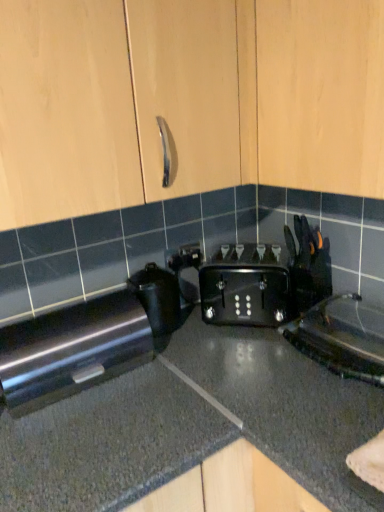
Where is `vacant area that lies between black plastic kettle at lower right, the first appliance positioned from the right, and black plastic toaster at center, which ranks as the first appliance in left-to-right order`? Image resolution: width=384 pixels, height=512 pixels. vacant area that lies between black plastic kettle at lower right, the first appliance positioned from the right, and black plastic toaster at center, which ranks as the first appliance in left-to-right order is located at coordinates (242, 352).